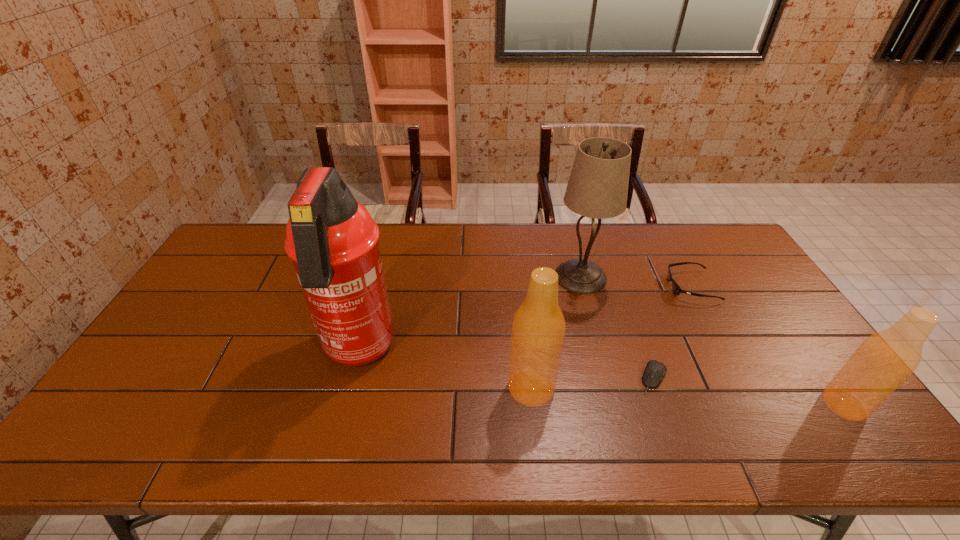
The width and height of the screenshot is (960, 540). Identify the location of the second object from left to right. (538, 328).

This screenshot has height=540, width=960. Identify the location of the third tallest object. (538, 328).

Find the location of a particular element. the rightmost object is located at coordinates (884, 360).

Locate an element on the screen. This screenshot has height=540, width=960. the shorter beer bottle is located at coordinates (884, 360).

You are a GUI agent. You are given a task and a screenshot of the screen. Output one action in this format:
    pyautogui.click(x=<x>, y=<y>)
    Task: Click on the second shortest object
    
    Given the screenshot: What is the action you would take?
    pyautogui.click(x=677, y=290)

The height and width of the screenshot is (540, 960). I want to click on the fifth object from left to right, so click(x=677, y=290).

Where is `lampshade`? The image size is (960, 540). lampshade is located at coordinates (597, 188).

I want to click on the leftmost object, so click(x=332, y=240).

Locate an element on the screen. The width and height of the screenshot is (960, 540). the shortest object is located at coordinates (655, 370).

Identify the location of free point located on the back of the left beer bottle. (525, 332).